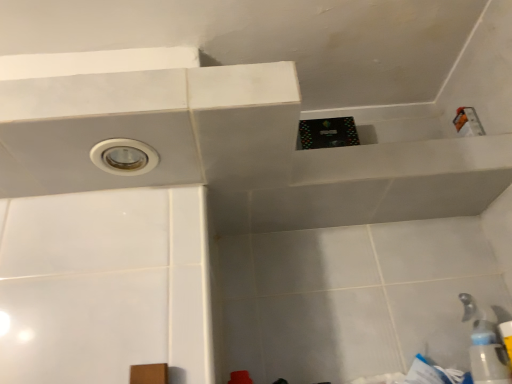
Question: Is transparent plastic bottle at lower right to the right of white plastic faucet at lower right from the viewer's perspective?

Choices:
 (A) yes
 (B) no

Answer: (B)

Question: From the image's perspective, would you say transparent plastic bottle at lower right is positioned over white plastic faucet at lower right?

Choices:
 (A) no
 (B) yes

Answer: (A)

Question: Considering the relative sizes of transparent plastic bottle at lower right and white plastic faucet at lower right in the image provided, is transparent plastic bottle at lower right bigger than white plastic faucet at lower right?

Choices:
 (A) yes
 (B) no

Answer: (B)

Question: Is transparent plastic bottle at lower right oriented away from white plastic faucet at lower right?

Choices:
 (A) no
 (B) yes

Answer: (A)

Question: From a real-world perspective, does transparent plastic bottle at lower right sit lower than white plastic faucet at lower right?

Choices:
 (A) yes
 (B) no

Answer: (A)

Question: Can you confirm if transparent plastic bottle at lower right is wider than white plastic faucet at lower right?

Choices:
 (A) yes
 (B) no

Answer: (A)

Question: Can you confirm if white plastic hole at upper left is positioned to the left of white plastic faucet at lower right?

Choices:
 (A) yes
 (B) no

Answer: (A)

Question: From a real-world perspective, is white plastic hole at upper left positioned under white plastic faucet at lower right based on gravity?

Choices:
 (A) no
 (B) yes

Answer: (A)

Question: Is white plastic hole at upper left touching white plastic faucet at lower right?

Choices:
 (A) yes
 (B) no

Answer: (B)

Question: Does white plastic hole at upper left have a lesser width compared to white plastic faucet at lower right?

Choices:
 (A) yes
 (B) no

Answer: (B)

Question: From the image's perspective, would you say white plastic hole at upper left is shown under white plastic faucet at lower right?

Choices:
 (A) yes
 (B) no

Answer: (B)

Question: Can you confirm if white plastic hole at upper left is smaller than white plastic faucet at lower right?

Choices:
 (A) no
 (B) yes

Answer: (B)

Question: From a real-world perspective, does white plastic faucet at lower right sit lower than transparent plastic bottle at lower right?

Choices:
 (A) no
 (B) yes

Answer: (A)